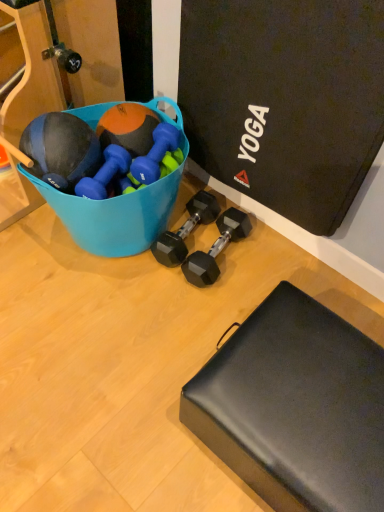
This screenshot has width=384, height=512. I want to click on free spot below black rubber dumbbell at center, which is the 4th dumbbell in left-to-right order (from a real-world perspective), so click(227, 251).